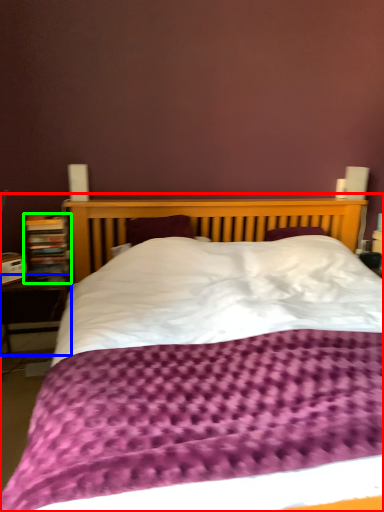
Question: Which is farther away from bed (highlighted by a red box)? table (highlighted by a blue box) or bookcase (highlighted by a green box)?

Choices:
 (A) table
 (B) bookcase

Answer: (A)